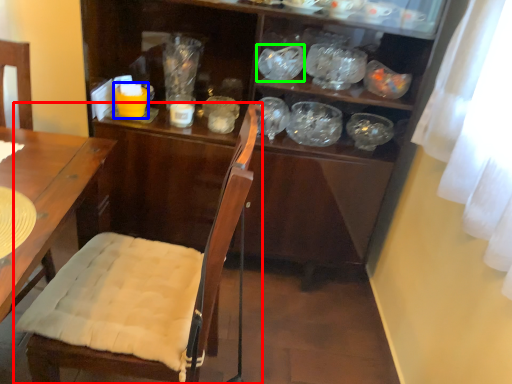
Question: Which object is positioned closest to chair (highlighted by a red box)? Select from tableware (highlighted by a blue box) and tableware (highlighted by a green box).

Choices:
 (A) tableware
 (B) tableware

Answer: (A)